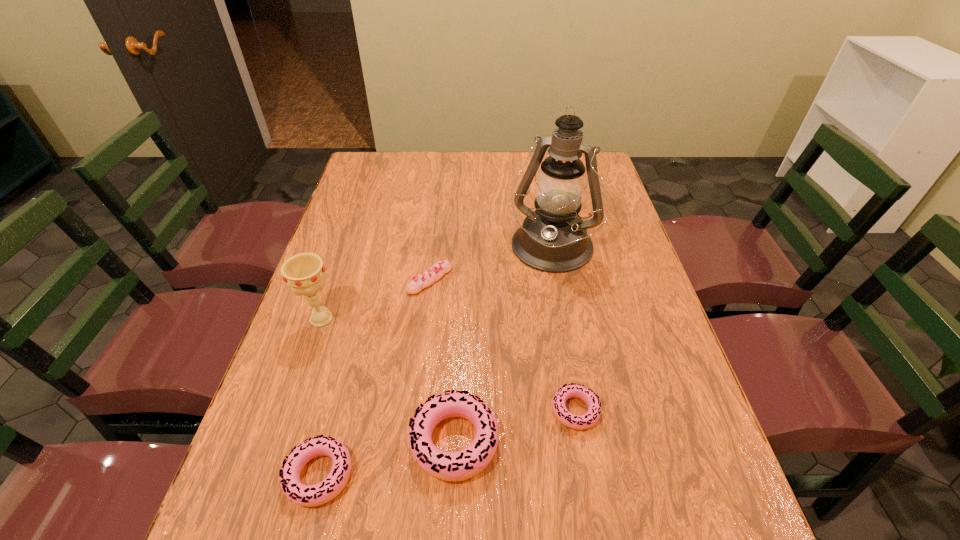
This screenshot has width=960, height=540. In order to click on blank area in the image that satisfies the following two spatial constraints: 1. on the back side of the oil lamp; 2. on the left side of the second doughnut from left to right in this screenshot , I will do `click(463, 250)`.

The height and width of the screenshot is (540, 960). I want to click on free point that satisfies the following two spatial constraints: 1. on the front side of the leftmost doughnut; 2. on the left side of the fifth shortest object, so click(269, 475).

Identify the location of vacant space that satisfies the following two spatial constraints: 1. on the front side of the shortest doughnut; 2. on the right side of the eclair. The height and width of the screenshot is (540, 960). (415, 410).